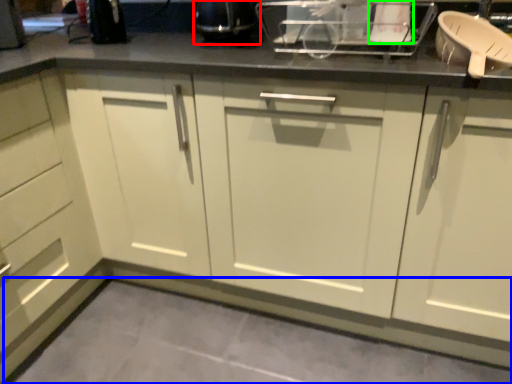
Question: Estimate the real-world distances between objects in this image. Which object is closer to appliance (highlighted by a red box), concrete (highlighted by a blue box) or appliance (highlighted by a green box)?

Choices:
 (A) concrete
 (B) appliance

Answer: (B)